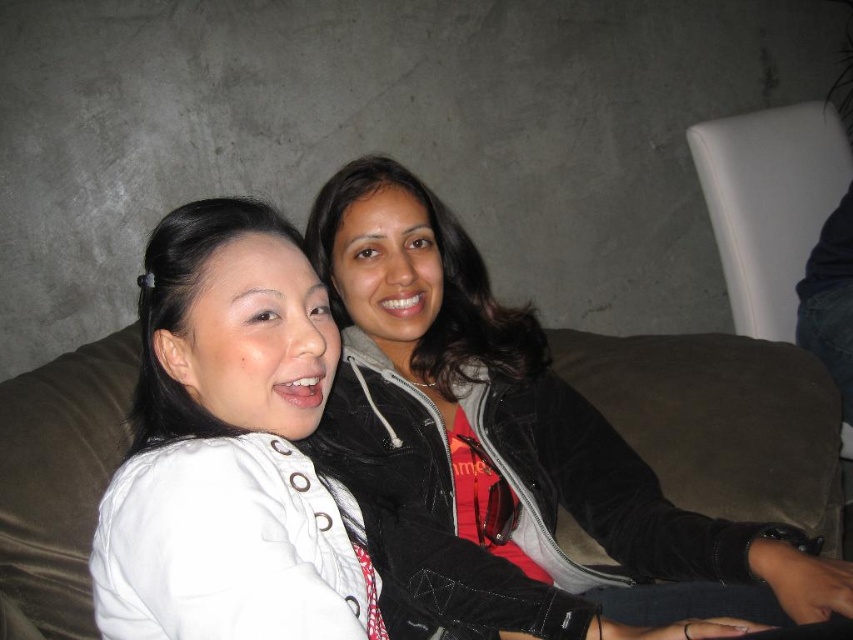
Who is more distant from viewer, (407,424) or (225,476)?

The point (407,424) is more distant.

Image resolution: width=853 pixels, height=640 pixels. I want to click on black velvet jacket at center, so click(x=511, y=456).